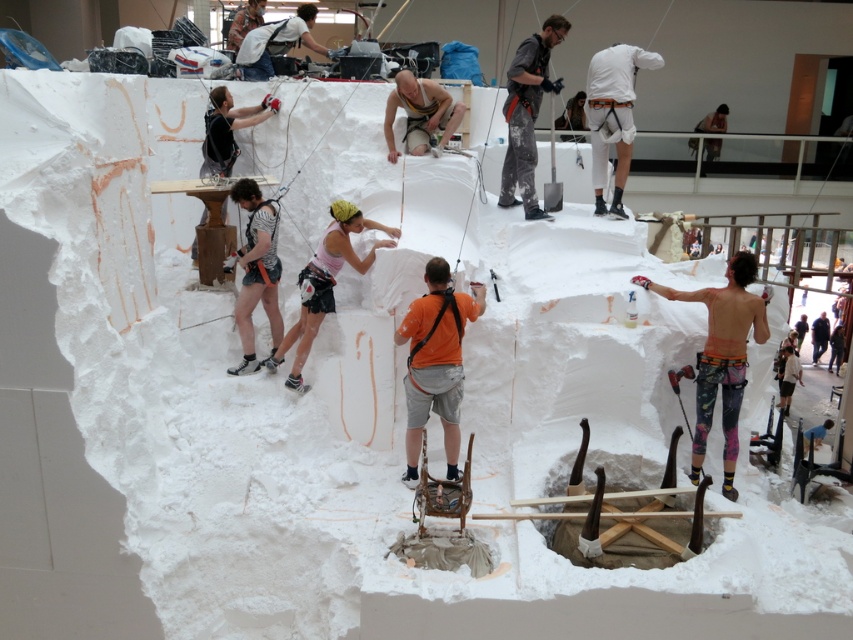
You are an observer looking at the scene. Which object is closer to you between the matte yellow harness at center and the white matte backpack at upper center?

The matte yellow harness at center is closer to you because it is in front of the white matte backpack at upper center.

You are an observer looking at the scene. You notice two items of clothing in the image. The first is a white matte shirt at upper right, and the second is a pink fabric at center. Which of these two items is bigger in size?

The white matte shirt at upper right is larger in size compared to the pink fabric at center.

Based on the photo, you are a safety inspector reviewing this sculpting project. You notice a harness at point (421, 115). Is the matte yellow harness at center properly anchored to the structure?

The matte yellow harness at center is located at point (421, 115), but the description does not provide information about its anchoring status. Therefore, it cannot be determined if it is properly anchored.